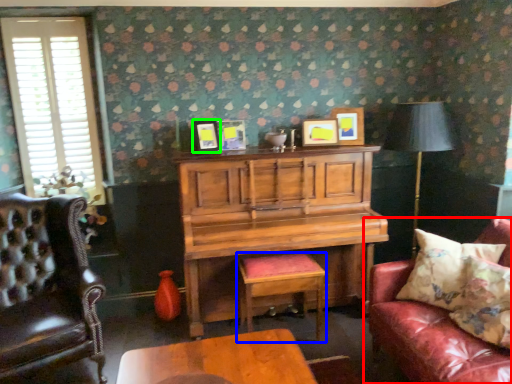
Question: Which object is positioned closest to studio couch (highlighted by a red box)? Select from stool (highlighted by a blue box) and picture frame (highlighted by a green box).

Choices:
 (A) stool
 (B) picture frame

Answer: (A)